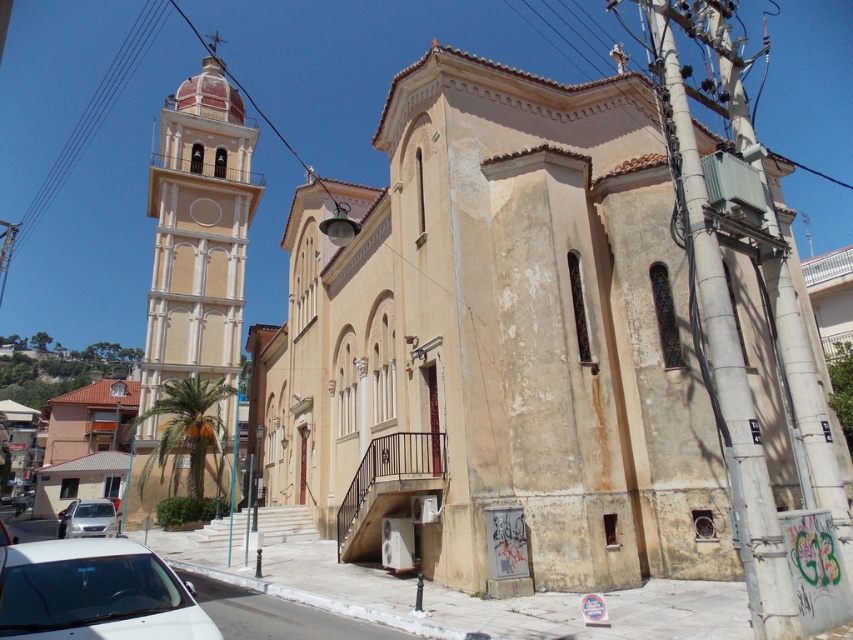
Who is positioned more to the left, beige stucco church at center or satin silver sedan at lower left?

From the viewer's perspective, satin silver sedan at lower left appears more on the left side.

Is the position of beige stucco church at center less distant than that of satin silver sedan at lower left?

Yes, beige stucco church at center is closer to the viewer.

Find the location of a particular element. The height and width of the screenshot is (640, 853). beige stucco church at center is located at coordinates (498, 340).

Which of these two, beige stucco bell tower at left or satin silver sedan at lower left, stands shorter?

satin silver sedan at lower left is shorter.

From the picture: Does beige stucco bell tower at left have a greater width compared to satin silver sedan at lower left?

Yes.

Is point (233, 195) in front of point (99, 536)?

That is False.

This screenshot has height=640, width=853. Find the location of `beige stucco bell tower at left`. beige stucco bell tower at left is located at coordinates (196, 237).

Is beige stucco church at center below beige stucco bell tower at left?

Correct, beige stucco church at center is located below beige stucco bell tower at left.

Is beige stucco church at center behind beige stucco bell tower at left?

That is False.

Locate an element on the screen. The image size is (853, 640). beige stucco church at center is located at coordinates (498, 340).